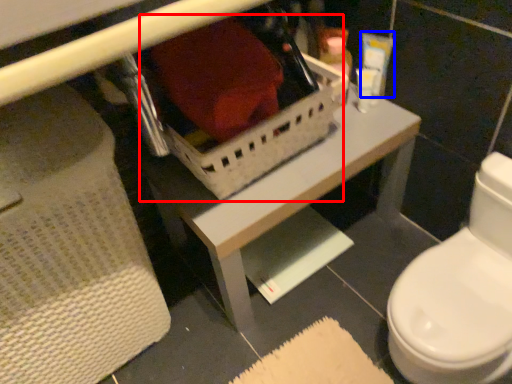
Question: Among these objects, which one is farthest to the camera, storage box (highlighted by a red box) or toiletry (highlighted by a blue box)?

Choices:
 (A) storage box
 (B) toiletry

Answer: (B)